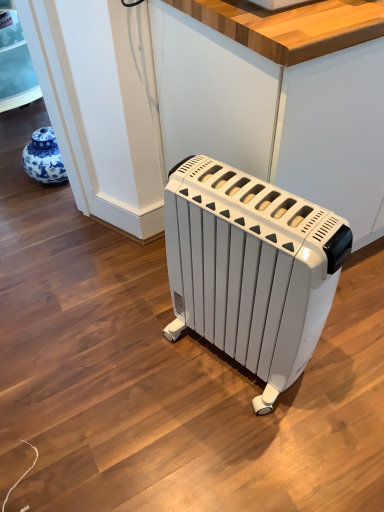
Measure the distance between point (263, 75) and camera.

A distance of 35.47 inches exists between point (263, 75) and camera.

Locate an element on the screen. wooden at center is located at coordinates click(276, 115).

Image resolution: width=384 pixels, height=512 pixels. What do you see at coordinates (276, 115) in the screenshot?
I see `wooden at center` at bounding box center [276, 115].

Image resolution: width=384 pixels, height=512 pixels. What do you see at coordinates (251, 269) in the screenshot? I see `white plastic radiator at center` at bounding box center [251, 269].

Image resolution: width=384 pixels, height=512 pixels. What are the coordinates of `white plastic radiator at center` in the screenshot? It's located at tap(251, 269).

The image size is (384, 512). Find the location of `wooden at center`. wooden at center is located at coordinates (276, 115).

Is wooden at center at the left side of white plastic radiator at center?

No, wooden at center is not to the left of white plastic radiator at center.

Considering the positions of objects wooden at center and white plastic radiator at center in the image provided, who is in front, wooden at center or white plastic radiator at center?

white plastic radiator at center is in front.

Considering the points (345, 74) and (272, 185), which point is behind, point (345, 74) or point (272, 185)?

The point (272, 185) is farther from the camera.

Looking at this image, from the image's perspective, is wooden at center over white plastic radiator at center?

Correct, wooden at center appears higher than white plastic radiator at center in the image.

From a real-world perspective, is wooden at center positioned over white plastic radiator at center based on gravity?

Correct, in the physical world, wooden at center is higher than white plastic radiator at center.

Can you confirm if wooden at center is wider than white plastic radiator at center?

Yes, wooden at center is wider than white plastic radiator at center.

Is wooden at center shorter than white plastic radiator at center?

In fact, wooden at center may be taller than white plastic radiator at center.

Considering the sizes of objects wooden at center and white plastic radiator at center in the image provided, who is smaller, wooden at center or white plastic radiator at center?

white plastic radiator at center.

Is white plastic radiator at center surrounded by wooden at center?

That's incorrect, white plastic radiator at center is not inside wooden at center.

Based on the photo, are wooden at center and white plastic radiator at center far apart?

That's not correct — wooden at center is a little close to white plastic radiator at center.

Consider the image. Is wooden at center oriented away from white plastic radiator at center?

wooden at center is not turned away from white plastic radiator at center.

How far apart are wooden at center and white plastic radiator at center?

wooden at center and white plastic radiator at center are 31.07 centimeters apart.

Identify the location of home appliance below the wooden at center (from a real-world perspective). (251, 269).

Visually, is white plastic radiator at center positioned to the left or to the right of wooden at center?

white plastic radiator at center is positioned on wooden at center's left side.

Which object is more forward, white plastic radiator at center or wooden at center?

white plastic radiator at center is more forward.

Does point (205, 217) come behind point (321, 68)?

Yes, it is.

From the image's perspective, is white plastic radiator at center above or below wooden at center?

white plastic radiator at center is below wooden at center.

From a real-world perspective, which is physically above, white plastic radiator at center or wooden at center?

wooden at center is physically above.

Looking at this image, considering the sizes of white plastic radiator at center and wooden at center in the image, is white plastic radiator at center wider or thinner than wooden at center?

In the image, white plastic radiator at center appears to be more narrow than wooden at center.

Looking at this image, is white plastic radiator at center taller or shorter than wooden at center?

white plastic radiator at center is shorter than wooden at center.

Between white plastic radiator at center and wooden at center, which one has larger size?

wooden at center.

Is wooden at center located within white plastic radiator at center?

No, wooden at center is not inside white plastic radiator at center.

Is white plastic radiator at center next to wooden at center and touching it?

white plastic radiator at center is not next to wooden at center, and they're not touching.

Is wooden at center at the back of white plastic radiator at center?

white plastic radiator at center is not turned away from wooden at center.

How distant is white plastic radiator at center from wooden at center?

12.23 inches.

Locate an element on the screen. This screenshot has height=512, width=384. counter located above the white plastic radiator at center (from a real-world perspective) is located at coordinates (276, 115).

Locate an element on the screen. The height and width of the screenshot is (512, 384). counter behind the white plastic radiator at center is located at coordinates (276, 115).

Find the location of a particular element. Image resolution: width=384 pixels, height=512 pixels. counter above the white plastic radiator at center (from the image's perspective) is located at coordinates (276, 115).